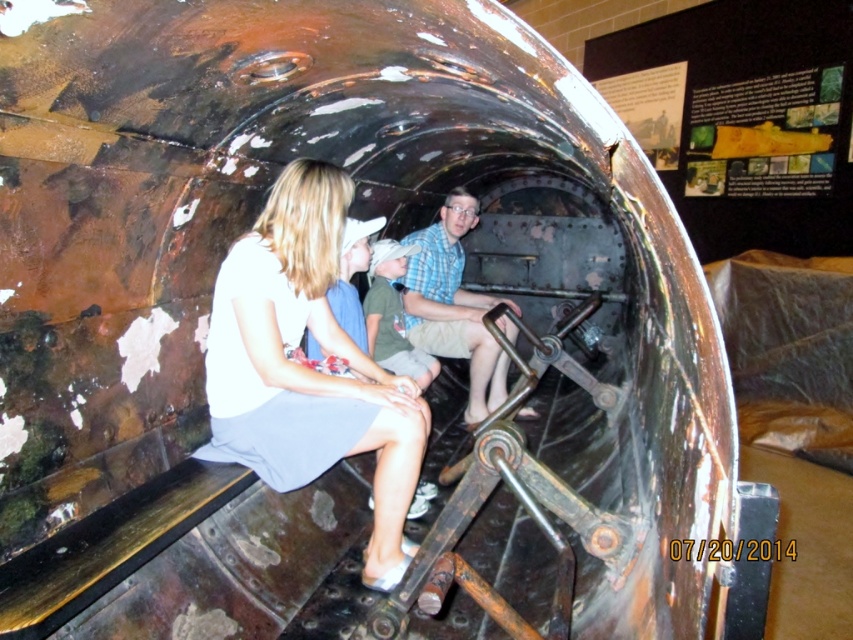
You are inside a submarine and need to find the emergency exit. You see a white fabric dress at center and a checkered fabric shirt at center. Which one is closer to the left side of the submarine?

The white fabric dress at center is to the left of the checkered fabric shirt at center, so it is closer to the left side of the submarine.

You are designing a new submarine interior and need to ensure there is enough space between the two central seats for both the white fabric dress at center and the checkered fabric shirt at center. Based on their widths, can you determine if the current space between the seats is sufficient?

The white fabric dress at center might be wider than checkered fabric shirt at center, so the space between the seats may not be sufficient if the dress requires more width. Further measurements are needed to confirm.

You are a photographer inside the cylindrical metal structure. You need to take a photo of both the white fabric dress at center and the checkered fabric shirt at center. Which one will be visible in the foreground of the photo?

The white fabric dress at center will be visible in the foreground because it is in front of the checkered fabric shirt at center.